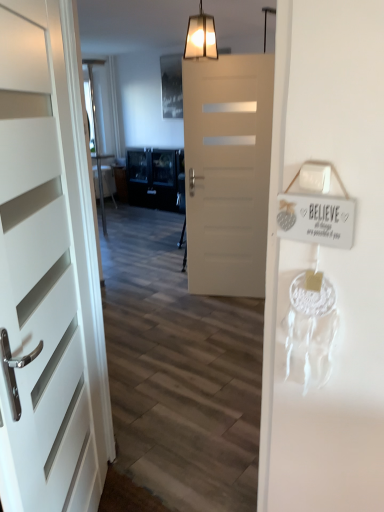
At what (x,y) coordinates should I click in order to perform the action: click on matte glass pendant light at upper center. Please return your answer as a coordinate pair (x, y). This screenshot has width=384, height=512. Looking at the image, I should click on (201, 36).

In order to face matte glass pendant light at upper center, should I rotate leftwards or rightwards?

To face it directly, rotate right by 1.219 degrees.

What do you see at coordinates (201, 36) in the screenshot? I see `matte glass pendant light at upper center` at bounding box center [201, 36].

Where is `matte glass pendant light at upper center`? The image size is (384, 512). matte glass pendant light at upper center is located at coordinates point(201,36).